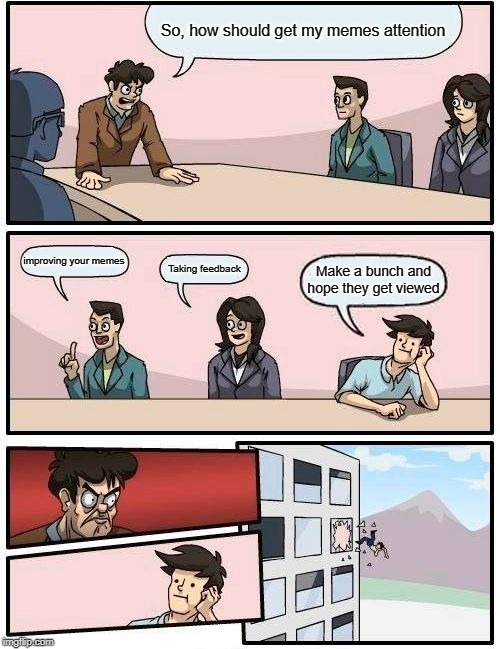
You are a GUI agent. You are given a task and a screenshot of the screen. Output one action in this format:
    pyautogui.click(x=<x>, y=<y>)
    Task: Click on the table
    Image resolution: width=500 pixels, height=649 pixels.
    Given the screenshot: What is the action you would take?
    291,191, 284,419